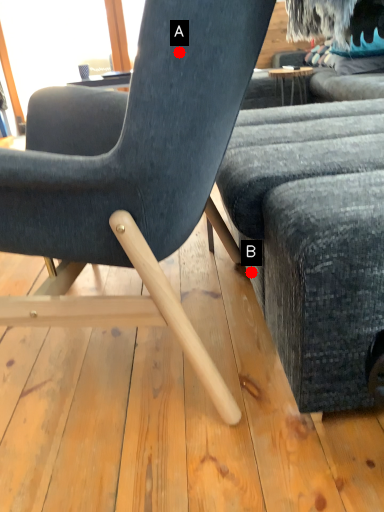
Question: Two points are circled on the image, labeled by A and B beside each circle. Which point is further to the camera?

Choices:
 (A) A is further
 (B) B is further

Answer: (B)